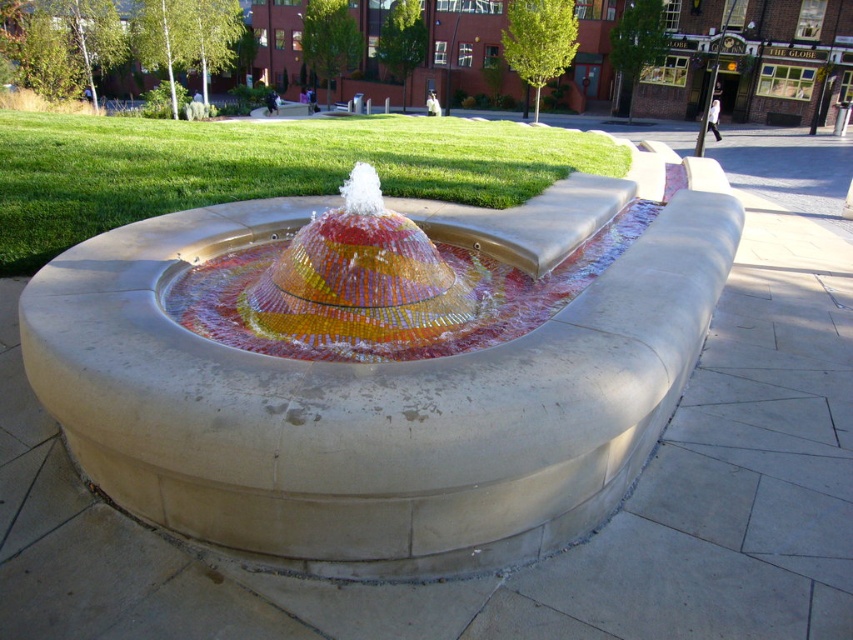
Question: Which point appears closest to the camera in this image?

Choices:
 (A) (408, 388)
 (B) (361, 346)

Answer: (A)

Question: Observing the image, what is the correct spatial positioning of mosaic tile fountain at center in reference to multicolored mosaic water at center?

Choices:
 (A) below
 (B) above

Answer: (B)

Question: Can you confirm if mosaic tile fountain at center is positioned to the right of multicolored mosaic water at center?

Choices:
 (A) yes
 (B) no

Answer: (A)

Question: Is mosaic tile fountain at center to the right of multicolored mosaic water at center from the viewer's perspective?

Choices:
 (A) no
 (B) yes

Answer: (B)

Question: Among these points, which one is nearest to the camera?

Choices:
 (A) (387, 314)
 (B) (572, 397)

Answer: (B)

Question: Which object is farther from the camera taking this photo?

Choices:
 (A) multicolored mosaic water at center
 (B) mosaic tile fountain at center

Answer: (A)